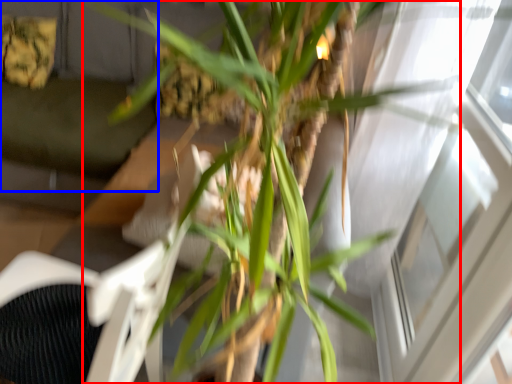
Question: Which object is further to the camera taking this photo, houseplant (highlighted by a red box) or couch (highlighted by a blue box)?

Choices:
 (A) houseplant
 (B) couch

Answer: (B)